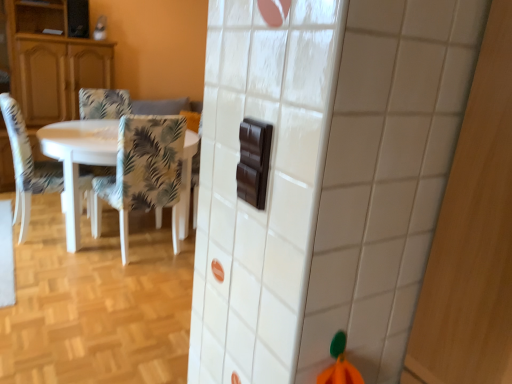
Question: From the image's perspective, is floral fabric chair at left, the 2th chair in the right-to-left sequence, above matte wood cabinet at left?

Choices:
 (A) no
 (B) yes

Answer: (A)

Question: Would you say matte wood cabinet at left is part of floral fabric chair at left, placed as the 2th chair when sorted from left to right,'s contents?

Choices:
 (A) yes
 (B) no

Answer: (B)

Question: Does floral fabric chair at left, the 2th chair in the right-to-left sequence, appear on the right side of matte wood cabinet at left?

Choices:
 (A) yes
 (B) no

Answer: (A)

Question: Is floral fabric chair at left, placed as the 2th chair when sorted from left to right, completely or partially outside of matte wood cabinet at left?

Choices:
 (A) no
 (B) yes

Answer: (B)

Question: From a real-world perspective, is floral fabric chair at left, placed as the 2th chair when sorted from left to right, physically above matte wood cabinet at left?

Choices:
 (A) yes
 (B) no

Answer: (B)

Question: Considering the relative sizes of floral fabric chair at left, the 2th chair in the right-to-left sequence, and matte wood cabinet at left in the image provided, is floral fabric chair at left, the 2th chair in the right-to-left sequence, smaller than matte wood cabinet at left?

Choices:
 (A) no
 (B) yes

Answer: (B)

Question: Considering the relative sizes of white glossy table at left and patterned fabric chair at left, the 1th chair in the left-to-right sequence, in the image provided, is white glossy table at left thinner than patterned fabric chair at left, the 1th chair in the left-to-right sequence,?

Choices:
 (A) yes
 (B) no

Answer: (B)

Question: From a real-world perspective, is white glossy table at left located higher than patterned fabric chair at left, the 1th chair in the left-to-right sequence?

Choices:
 (A) yes
 (B) no

Answer: (B)

Question: Are white glossy table at left and patterned fabric chair at left, which is the third chair in right-to-left order, making contact?

Choices:
 (A) no
 (B) yes

Answer: (A)

Question: Does white glossy table at left appear on the left side of patterned fabric chair at left, the 1th chair in the left-to-right sequence?

Choices:
 (A) yes
 (B) no

Answer: (B)

Question: Are white glossy table at left and patterned fabric chair at left, which is the third chair in right-to-left order, far apart?

Choices:
 (A) no
 (B) yes

Answer: (A)

Question: Can patterned fabric chair at left, the 1th chair in the left-to-right sequence, be found inside white glossy table at left?

Choices:
 (A) yes
 (B) no

Answer: (A)

Question: Would you say floral fabric chair at left, placed as the 2th chair when sorted from left to right, is outside patterned fabric chair at left, acting as the first chair starting from the right?

Choices:
 (A) yes
 (B) no

Answer: (A)